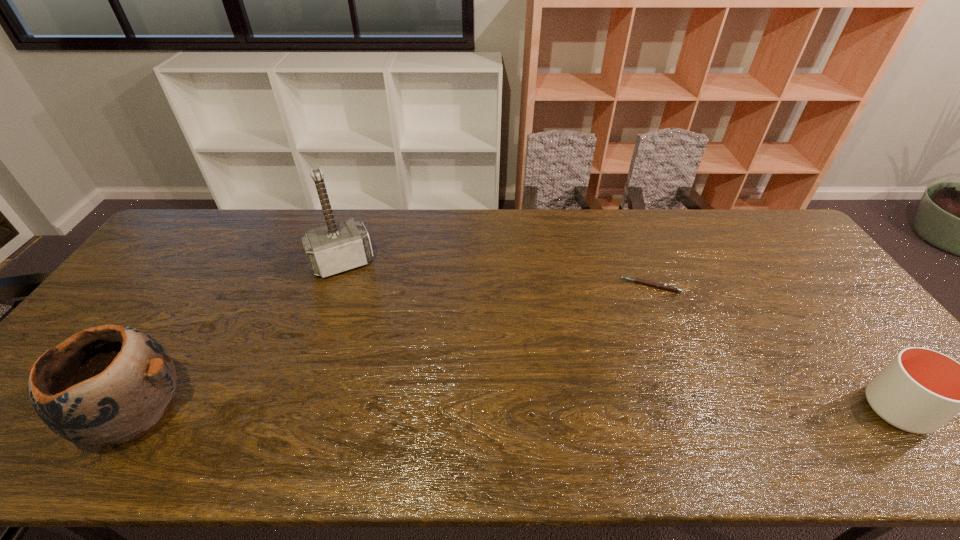
Find the location of `vacant space on the desktop that is between the leftmost object and the cup and is positioned for striking with the head of the hammer`. vacant space on the desktop that is between the leftmost object and the cup and is positioned for striking with the head of the hammer is located at coordinates (407, 411).

Image resolution: width=960 pixels, height=540 pixels. In order to click on vacant space on the desktop that is between the leftmost object and the rightmost object and is positioned at the nib of the shortest object in this screenshot , I will do `click(460, 410)`.